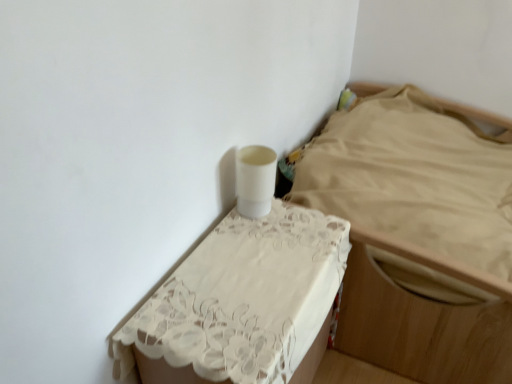
Describe the element at coordinates (418, 233) in the screenshot. The width and height of the screenshot is (512, 384). I see `white glossy nightstand at upper right, acting as the second furniture starting from the left` at that location.

At what (x,y) coordinates should I click in order to perform the action: click on white glossy nightstand at upper right, the first furniture viewed from the right. Please return your answer as a coordinate pair (x, y). The image size is (512, 384). Looking at the image, I should click on (418, 233).

Where is `white lace tablecloth at upper center, which is counted as the 2th furniture, starting from the right`? white lace tablecloth at upper center, which is counted as the 2th furniture, starting from the right is located at coordinates (245, 299).

Describe the element at coordinates (245, 299) in the screenshot. This screenshot has height=384, width=512. I see `white lace tablecloth at upper center, which is counted as the 2th furniture, starting from the right` at that location.

The width and height of the screenshot is (512, 384). Find the location of `white glossy nightstand at upper right, acting as the second furniture starting from the left`. white glossy nightstand at upper right, acting as the second furniture starting from the left is located at coordinates (418, 233).

Considering the relative positions of white glossy nightstand at upper right, acting as the second furniture starting from the left, and white lace tablecloth at upper center, which is counted as the 2th furniture, starting from the right, in the image provided, is white glossy nightstand at upper right, acting as the second furniture starting from the left, to the left of white lace tablecloth at upper center, which is counted as the 2th furniture, starting from the right, from the viewer's perspective?

Incorrect, white glossy nightstand at upper right, acting as the second furniture starting from the left, is not on the left side of white lace tablecloth at upper center, which is counted as the 2th furniture, starting from the right.

Is white glossy nightstand at upper right, the first furniture viewed from the right, in front of or behind white lace tablecloth at upper center, positioned as the first furniture in left-to-right order, in the image?

white glossy nightstand at upper right, the first furniture viewed from the right, is positioned farther from the viewer than white lace tablecloth at upper center, positioned as the first furniture in left-to-right order.

Is point (480, 304) in front of point (287, 251)?

No, it is not.

From the image's perspective, which one is positioned higher, white glossy nightstand at upper right, the first furniture viewed from the right, or white lace tablecloth at upper center, positioned as the first furniture in left-to-right order?

From the image's view, white glossy nightstand at upper right, the first furniture viewed from the right, is above.

From a real-world perspective, which is physically above, white glossy nightstand at upper right, the first furniture viewed from the right, or white lace tablecloth at upper center, positioned as the first furniture in left-to-right order?

In real-world perspective, white glossy nightstand at upper right, the first furniture viewed from the right, is above.

Does white glossy nightstand at upper right, the first furniture viewed from the right, have a lesser width compared to white lace tablecloth at upper center, which is counted as the 2th furniture, starting from the right?

No, white glossy nightstand at upper right, the first furniture viewed from the right, is not thinner than white lace tablecloth at upper center, which is counted as the 2th furniture, starting from the right.

Is white glossy nightstand at upper right, acting as the second furniture starting from the left, taller or shorter than white lace tablecloth at upper center, positioned as the first furniture in left-to-right order?

In the image, white glossy nightstand at upper right, acting as the second furniture starting from the left, appears to be shorter than white lace tablecloth at upper center, positioned as the first furniture in left-to-right order.

Is white glossy nightstand at upper right, the first furniture viewed from the right, smaller than white lace tablecloth at upper center, positioned as the first furniture in left-to-right order?

No, white glossy nightstand at upper right, the first furniture viewed from the right, is not smaller than white lace tablecloth at upper center, positioned as the first furniture in left-to-right order.

Can we say white glossy nightstand at upper right, the first furniture viewed from the right, lies outside white lace tablecloth at upper center, which is counted as the 2th furniture, starting from the right?

Yes, white glossy nightstand at upper right, the first furniture viewed from the right, is not within white lace tablecloth at upper center, which is counted as the 2th furniture, starting from the right.

Is white glossy nightstand at upper right, the first furniture viewed from the right, beside white lace tablecloth at upper center, which is counted as the 2th furniture, starting from the right?

white glossy nightstand at upper right, the first furniture viewed from the right, and white lace tablecloth at upper center, which is counted as the 2th furniture, starting from the right, are clearly separated.

Is white glossy nightstand at upper right, the first furniture viewed from the right, positioned with its back to white lace tablecloth at upper center, which is counted as the 2th furniture, starting from the right?

white glossy nightstand at upper right, the first furniture viewed from the right, does not have its back to white lace tablecloth at upper center, which is counted as the 2th furniture, starting from the right.

How many degrees apart are the facing directions of white glossy nightstand at upper right, acting as the second furniture starting from the left, and white lace tablecloth at upper center, positioned as the first furniture in left-to-right order?

179 degrees.

At what (x,y) coordinates should I click in order to perform the action: click on furniture in front of the white glossy nightstand at upper right, the first furniture viewed from the right. Please return your answer as a coordinate pair (x, y). Looking at the image, I should click on (245, 299).

Considering the positions of objects white lace tablecloth at upper center, which is counted as the 2th furniture, starting from the right, and white glossy nightstand at upper right, the first furniture viewed from the right, in the image provided, who is more to the left, white lace tablecloth at upper center, which is counted as the 2th furniture, starting from the right, or white glossy nightstand at upper right, the first furniture viewed from the right,?

white lace tablecloth at upper center, which is counted as the 2th furniture, starting from the right.

Which object is further away from the camera taking this photo, white lace tablecloth at upper center, which is counted as the 2th furniture, starting from the right, or white glossy nightstand at upper right, acting as the second furniture starting from the left?

white glossy nightstand at upper right, acting as the second furniture starting from the left, is behind.

Is point (324, 226) behind point (462, 260)?

No.

From the image's perspective, is white lace tablecloth at upper center, positioned as the first furniture in left-to-right order, located above or below white glossy nightstand at upper right, acting as the second furniture starting from the left?

white lace tablecloth at upper center, positioned as the first furniture in left-to-right order, is below white glossy nightstand at upper right, acting as the second furniture starting from the left.

From a real-world perspective, which is physically above, white lace tablecloth at upper center, positioned as the first furniture in left-to-right order, or white glossy nightstand at upper right, acting as the second furniture starting from the left?

In real-world perspective, white glossy nightstand at upper right, acting as the second furniture starting from the left, is above.

Between white lace tablecloth at upper center, which is counted as the 2th furniture, starting from the right, and white glossy nightstand at upper right, acting as the second furniture starting from the left, which one has larger width?

white glossy nightstand at upper right, acting as the second furniture starting from the left.

Between white lace tablecloth at upper center, which is counted as the 2th furniture, starting from the right, and white glossy nightstand at upper right, the first furniture viewed from the right, which one has less height?

With less height is white glossy nightstand at upper right, the first furniture viewed from the right.

Between white lace tablecloth at upper center, positioned as the first furniture in left-to-right order, and white glossy nightstand at upper right, acting as the second furniture starting from the left, which one has smaller size?

Smaller between the two is white lace tablecloth at upper center, positioned as the first furniture in left-to-right order.

Is white lace tablecloth at upper center, positioned as the first furniture in left-to-right order, inside or outside of white glossy nightstand at upper right, the first furniture viewed from the right?

white lace tablecloth at upper center, positioned as the first furniture in left-to-right order, is not inside white glossy nightstand at upper right, the first furniture viewed from the right, it's outside.

Is white lace tablecloth at upper center, which is counted as the 2th furniture, starting from the right, next to white glossy nightstand at upper right, the first furniture viewed from the right?

They are not placed beside each other.

Could you tell me if white lace tablecloth at upper center, positioned as the first furniture in left-to-right order, is turned towards white glossy nightstand at upper right, acting as the second furniture starting from the left?

No, white lace tablecloth at upper center, positioned as the first furniture in left-to-right order, is not aimed at white glossy nightstand at upper right, acting as the second furniture starting from the left.

Can you tell me how much white lace tablecloth at upper center, positioned as the first furniture in left-to-right order, and white glossy nightstand at upper right, the first furniture viewed from the right, differ in facing direction?

179 degrees.

Identify the location of furniture that is above the white lace tablecloth at upper center, which is counted as the 2th furniture, starting from the right (from a real-world perspective). (418, 233).

Where is `furniture that is on the left side of white glossy nightstand at upper right, acting as the second furniture starting from the left`? The image size is (512, 384). furniture that is on the left side of white glossy nightstand at upper right, acting as the second furniture starting from the left is located at coordinates (245, 299).

Locate an element on the screen. The image size is (512, 384). furniture that is above the white lace tablecloth at upper center, which is counted as the 2th furniture, starting from the right (from the image's perspective) is located at coordinates (418, 233).